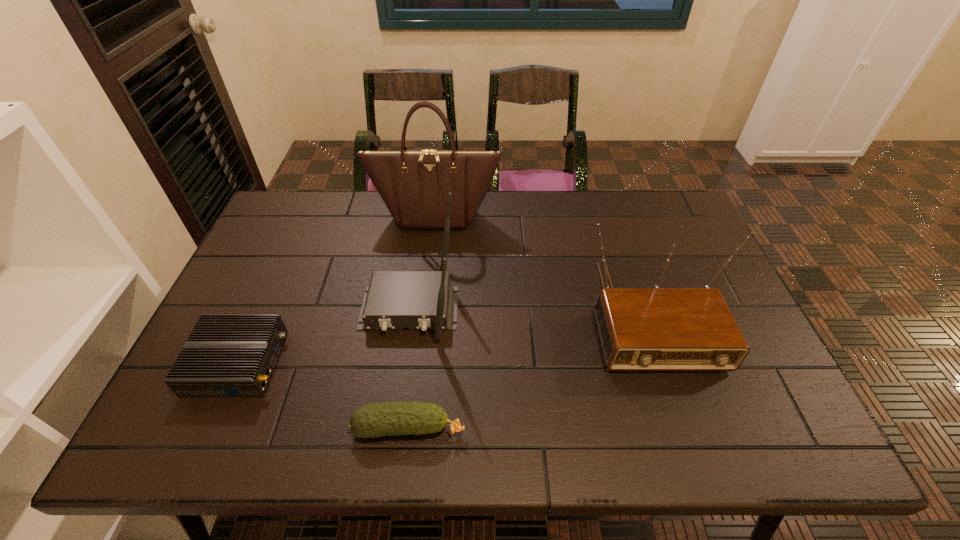
Where is `free space located on the back panel of the shorter router`? This screenshot has width=960, height=540. free space located on the back panel of the shorter router is located at coordinates (426, 362).

Identify the location of vacant area situated 0.210m at the blossom end of the cucumber. (562, 428).

Image resolution: width=960 pixels, height=540 pixels. Find the location of `object that is at the far edge`. object that is at the far edge is located at coordinates (414, 184).

Locate an element on the screen. Image resolution: width=960 pixels, height=540 pixels. object present at the near edge is located at coordinates (377, 419).

At what (x,y) coordinates should I click in order to perform the action: click on object at the left edge. Please return your answer as a coordinate pair (x, y). Looking at the image, I should click on (227, 355).

This screenshot has width=960, height=540. Find the location of `object present at the right edge`. object present at the right edge is located at coordinates (641, 329).

I want to click on vacant space at the far edge of the desktop, so click(530, 212).

The height and width of the screenshot is (540, 960). In order to click on vacant space at the near edge of the desktop in this screenshot , I will do `click(589, 425)`.

Identify the location of vacant space at the left edge of the desktop. (266, 307).

The width and height of the screenshot is (960, 540). What are the coordinates of `vacant space at the right edge of the desktop` in the screenshot? It's located at [x=775, y=387].